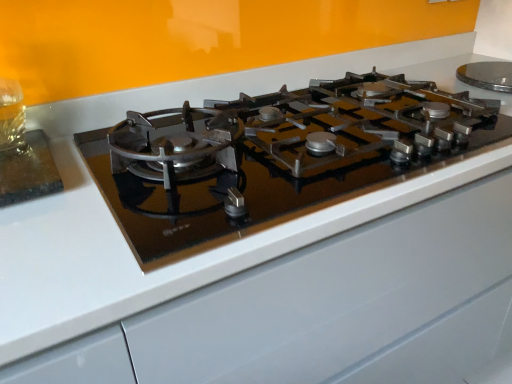
Question: Should I look upward or downward to see satin black gas stove at center?

Choices:
 (A) down
 (B) up

Answer: (B)